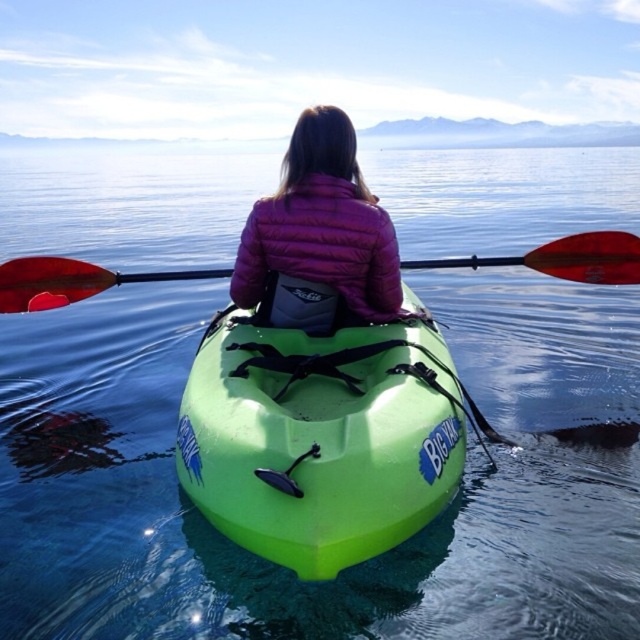
Does green plastic canoe at center come in front of purple puffy jacket at center?

Yes, it is in front of purple puffy jacket at center.

The height and width of the screenshot is (640, 640). In order to click on green plastic canoe at center in this screenshot , I will do `click(320, 438)`.

Where is `green plastic canoe at center`? This screenshot has height=640, width=640. green plastic canoe at center is located at coordinates (320, 438).

Looking at this image, is green plastic canoe at center closer to the viewer compared to red plastic paddle at center?

Yes, green plastic canoe at center is closer to the viewer.

Is green plastic canoe at center smaller than red plastic paddle at center?

Actually, green plastic canoe at center might be larger than red plastic paddle at center.

Is point (356, 493) farther from camera compared to point (611, 269)?

No, it is not.

Find the location of `green plastic canoe at center`. green plastic canoe at center is located at coordinates (320, 438).

Is point (364, 272) behind point (86, 294)?

No, it is in front of (86, 294).

Can you confirm if purple puffy jacket at center is smaller than red plastic paddle at center?

No.

Who is more distant from viewer, (358, 276) or (8, 282)?

Point (8, 282)

Find the location of a particular element. The image size is (640, 640). purple puffy jacket at center is located at coordinates coord(323,227).